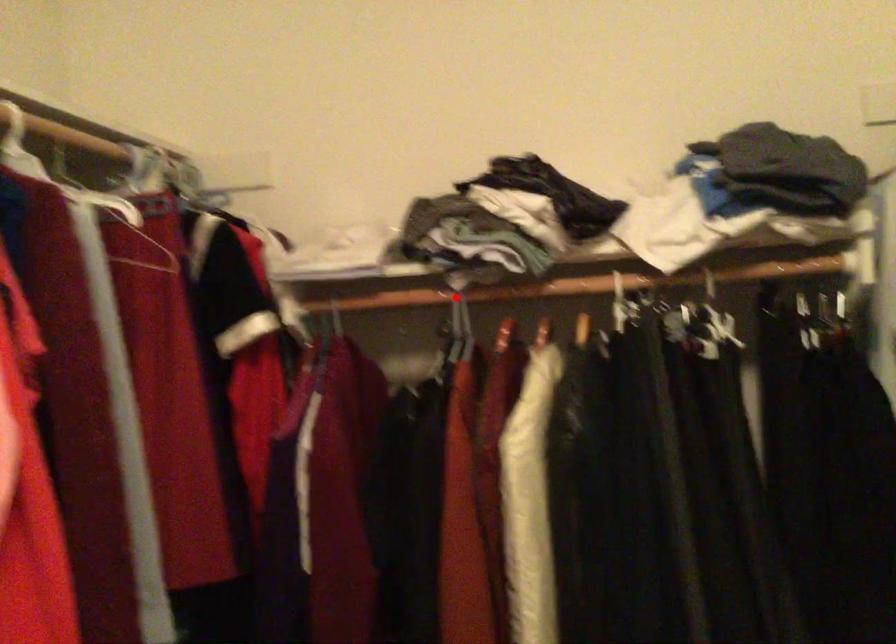
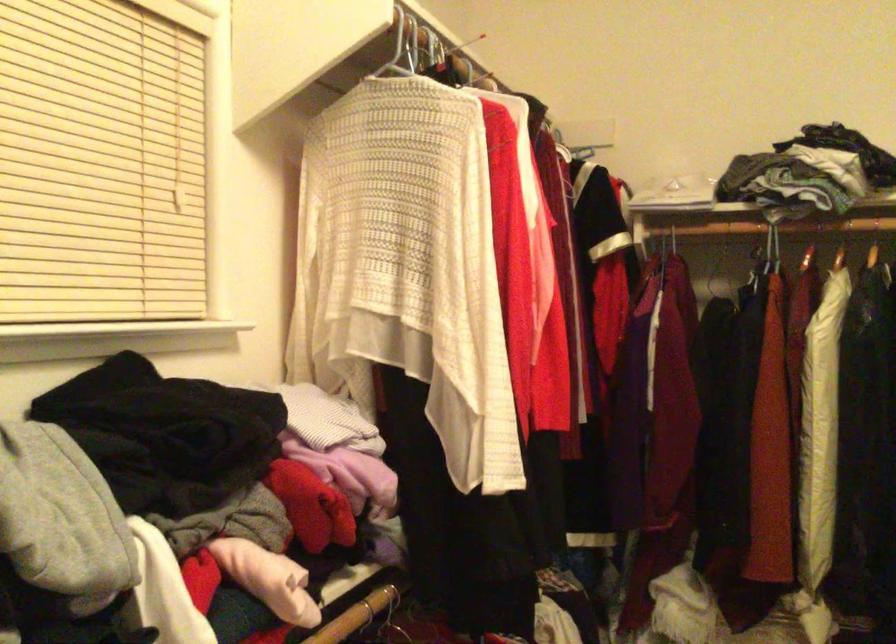
Locate, in the second image, the point that corresponds to the highlighted location in the first image.

(774, 228)